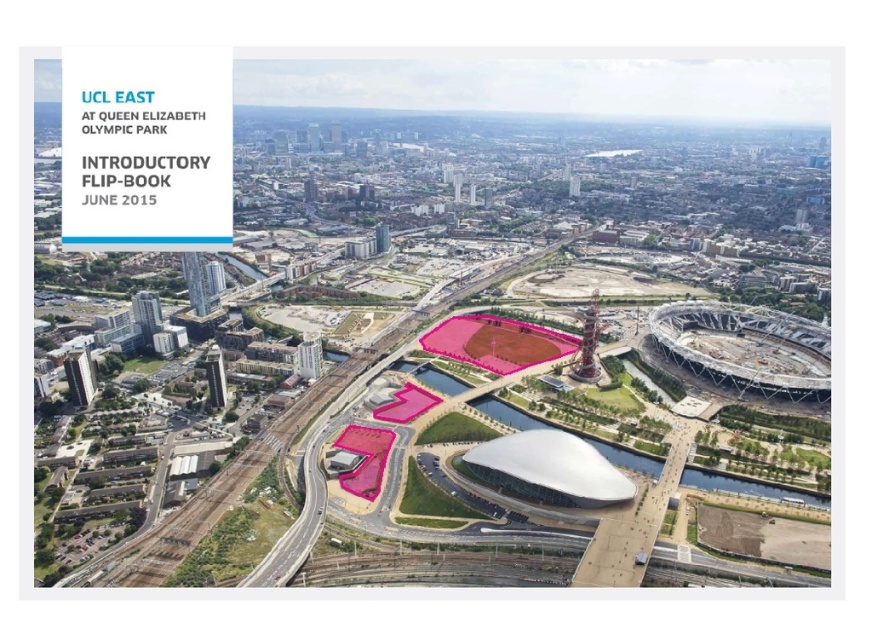
Which is above, white smooth stadium at center or pink matte football field at center?

white smooth stadium at center is higher up.

Is white smooth stadium at center wider than pink matte football field at center?

Correct, the width of white smooth stadium at center exceeds that of pink matte football field at center.

Between point (494, 380) and point (444, 346), which one is positioned behind?

The point (444, 346) is behind.

This screenshot has width=872, height=640. In order to click on white smooth stadium at center in this screenshot , I will do `click(270, 460)`.